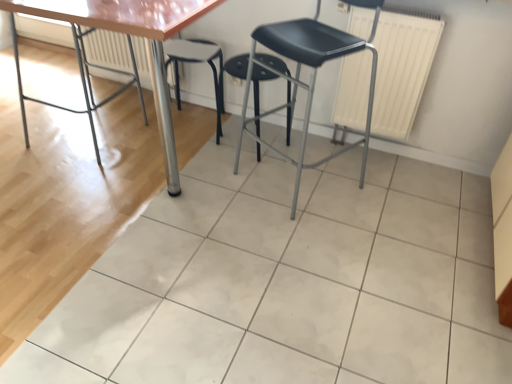
Question: Is white matte radiator at upper right, the second radiator positioned from the back, further to the viewer compared to white glossy tile at center?

Choices:
 (A) yes
 (B) no

Answer: (A)

Question: Is white matte radiator at upper right, the second radiator positioned from the back, wider than white glossy tile at center?

Choices:
 (A) no
 (B) yes

Answer: (A)

Question: Does white matte radiator at upper right, which appears as the first radiator when viewed from the front, have a smaller size compared to white glossy tile at center?

Choices:
 (A) yes
 (B) no

Answer: (A)

Question: Considering the relative positions of white matte radiator at upper right, placed as the 2th radiator when sorted from left to right, and white glossy tile at center in the image provided, is white matte radiator at upper right, placed as the 2th radiator when sorted from left to right, to the right of white glossy tile at center from the viewer's perspective?

Choices:
 (A) yes
 (B) no

Answer: (A)

Question: Are white matte radiator at upper right, the second radiator positioned from the back, and white glossy tile at center located far from each other?

Choices:
 (A) no
 (B) yes

Answer: (A)

Question: From their relative heights in the image, would you say matte black stool at center is taller or shorter than black plastic stool at center, acting as the second stool starting from the left?

Choices:
 (A) short
 (B) tall

Answer: (B)

Question: In terms of width, does matte black stool at center look wider or thinner when compared to black plastic stool at center, acting as the second stool starting from the left?

Choices:
 (A) thin
 (B) wide

Answer: (B)

Question: Which is correct: matte black stool at center is inside black plastic stool at center, acting as the second stool starting from the left, or outside of it?

Choices:
 (A) outside
 (B) inside

Answer: (A)

Question: From a real-world perspective, is matte black stool at center positioned above or below black plastic stool at center, the 1th stool viewed from the right?

Choices:
 (A) below
 (B) above

Answer: (B)

Question: Is white glossy tile at center wider or thinner than black plastic stool at center, arranged as the 1th stool when viewed from the left?

Choices:
 (A) wide
 (B) thin

Answer: (A)

Question: Do you think white glossy tile at center is within black plastic stool at center, arranged as the 1th stool when viewed from the left, or outside of it?

Choices:
 (A) inside
 (B) outside

Answer: (B)

Question: Considering the positions of white glossy tile at center and black plastic stool at center, the second stool from the right, in the image, is white glossy tile at center bigger or smaller than black plastic stool at center, the second stool from the right,?

Choices:
 (A) big
 (B) small

Answer: (A)

Question: From the image's perspective, is white glossy tile at center above or below black plastic stool at center, arranged as the 1th stool when viewed from the left?

Choices:
 (A) above
 (B) below

Answer: (B)

Question: In the image, is matte black stool at center positioned in front of or behind white textured radiator at upper center, which is counted as the first radiator, starting from the back?

Choices:
 (A) behind
 (B) front

Answer: (B)

Question: From the image's perspective, is matte black stool at center positioned above or below white textured radiator at upper center, the second radiator from the right?

Choices:
 (A) above
 (B) below

Answer: (B)